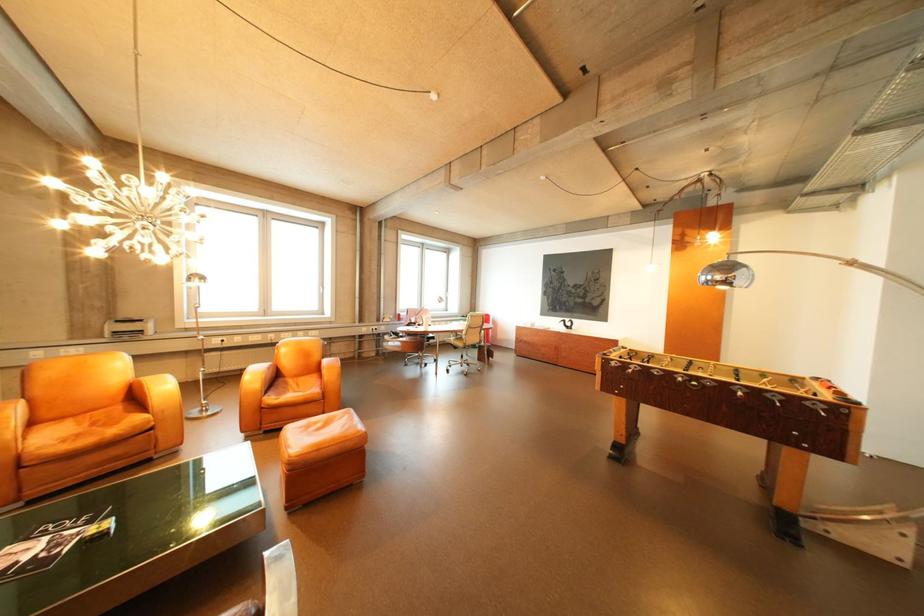
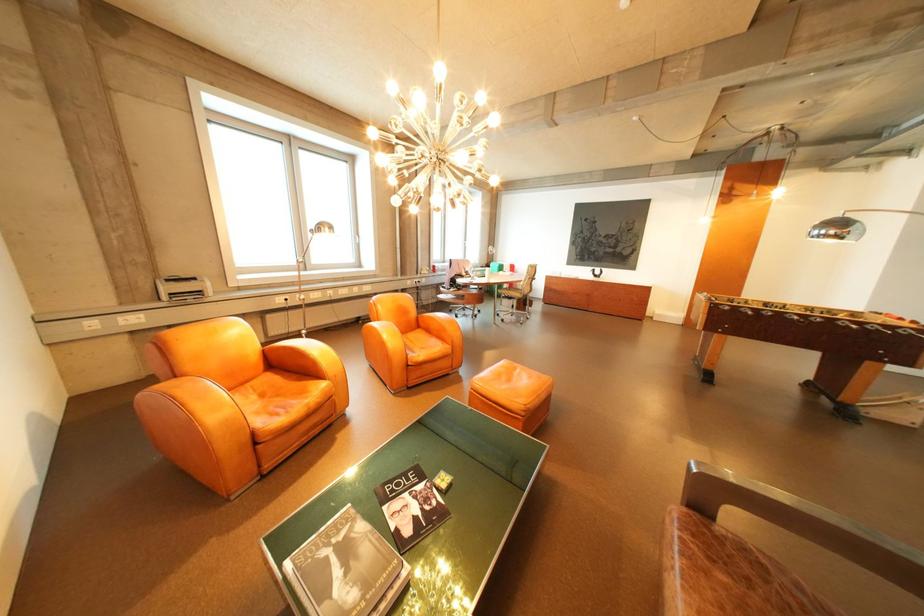
In the second image, find the point that corresponds to the point at 107,424 in the first image.

(275, 395)